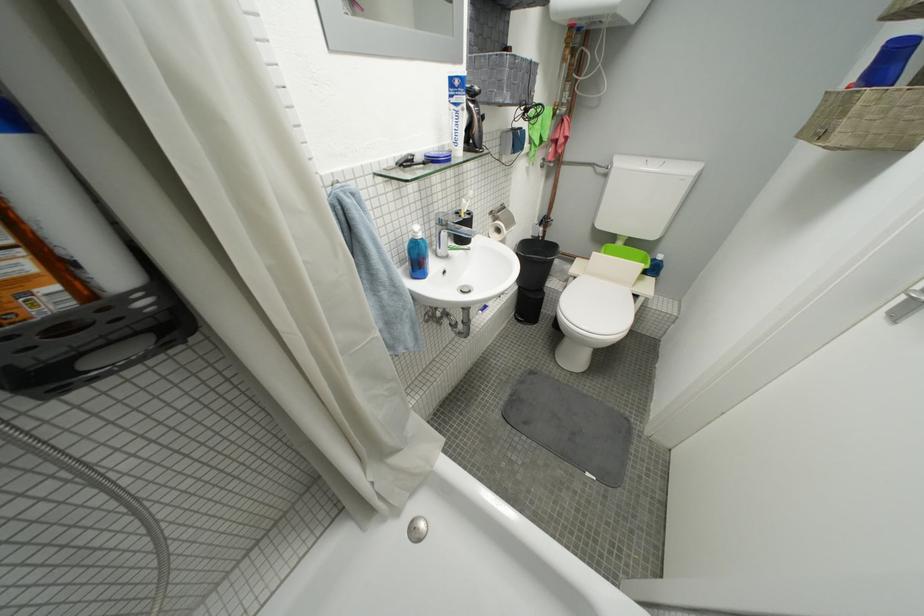
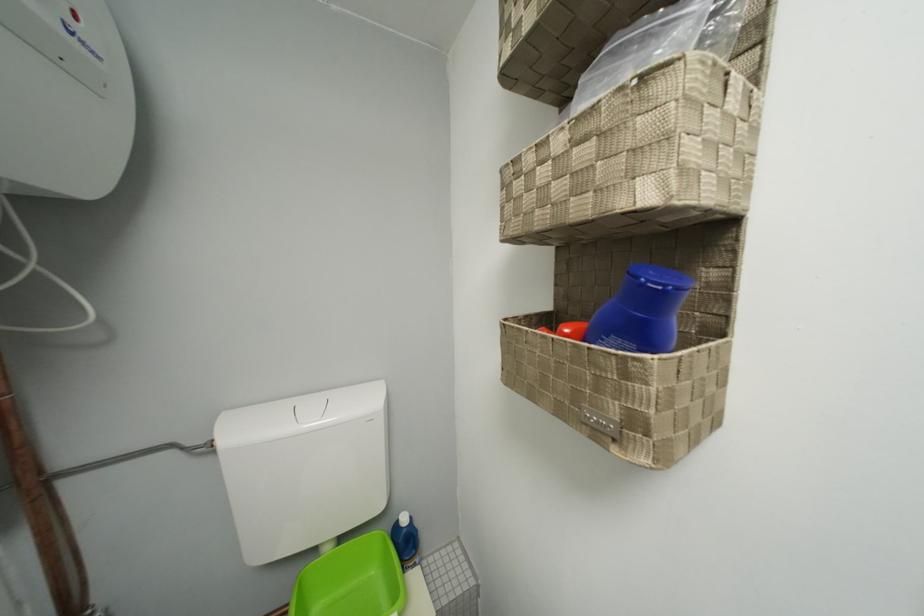
The point at [628,246] is marked in the first image. Where is the corresponding point in the second image?

(335, 552)